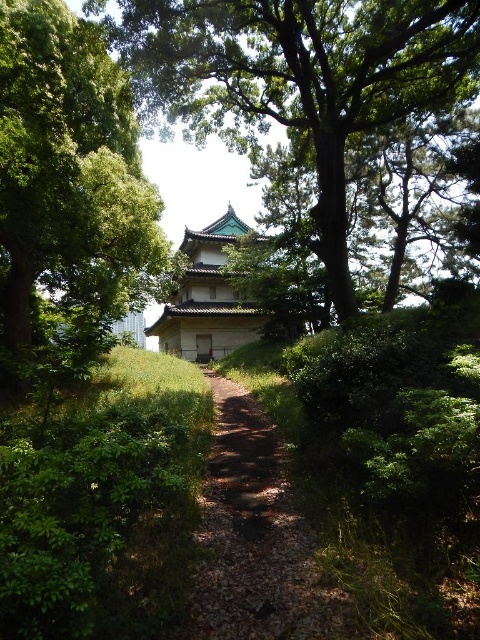
Question: Which object is closer to the camera taking this photo?

Choices:
 (A) green stone pagoda at center
 (B) green textured tree at center
 (C) green leafy tree at center
 (D) dirt path at center

Answer: (D)

Question: Where is green textured tree at center located in relation to dirt path at center in the image?

Choices:
 (A) below
 (B) above

Answer: (B)

Question: Among these objects, which one is nearest to the camera?

Choices:
 (A) green stone pagoda at center
 (B) green textured tree at center
 (C) green leafy tree at center

Answer: (C)

Question: Is dirt path at center closer to the viewer compared to green stone pagoda at center?

Choices:
 (A) no
 (B) yes

Answer: (B)

Question: Does green textured tree at center have a smaller size compared to dirt path at center?

Choices:
 (A) yes
 (B) no

Answer: (B)

Question: Which point is closer to the camera?

Choices:
 (A) (250, 404)
 (B) (31, 188)

Answer: (B)